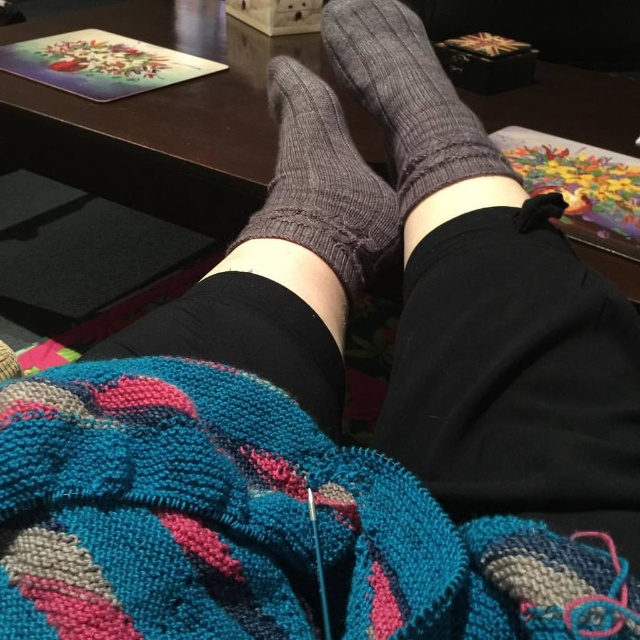
You are a delivery robot that needs to place a small package between the knitted woolen blanket at lower center and the dark gray knitted sock at center. Can you fit the package there if it measures 10 inches in length?

The knitted woolen blanket at lower center and dark gray knitted sock at center are 11.09 inches apart. Since the package is 10 inches long, it can fit between them as there is enough space.